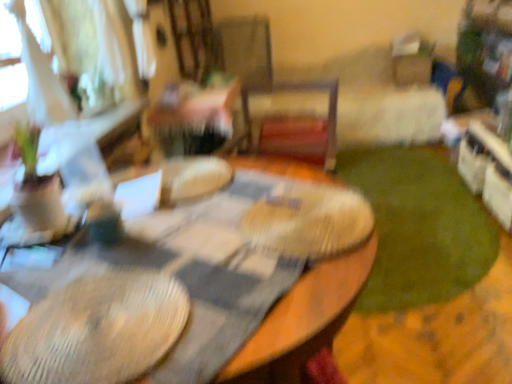
Question: Would you say wooden table at center is inside or outside green plush carpet at lower right?

Choices:
 (A) inside
 (B) outside

Answer: (B)

Question: Would you say wooden table at center is to the left or to the right of green plush carpet at lower right in the picture?

Choices:
 (A) right
 (B) left

Answer: (B)

Question: Considering the positions of wooden table at center and green plush carpet at lower right in the image, is wooden table at center bigger or smaller than green plush carpet at lower right?

Choices:
 (A) big
 (B) small

Answer: (A)

Question: Is green plush carpet at lower right spatially inside wooden table at center, or outside of it?

Choices:
 (A) inside
 (B) outside

Answer: (B)

Question: Would you say green plush carpet at lower right is to the left or to the right of wooden table at center in the picture?

Choices:
 (A) right
 (B) left

Answer: (A)

Question: From the image's perspective, relative to wooden table at center, is green plush carpet at lower right above or below?

Choices:
 (A) above
 (B) below

Answer: (A)

Question: Is point [416, 279] positioned closer to the camera than point [252, 347]?

Choices:
 (A) closer
 (B) farther

Answer: (B)